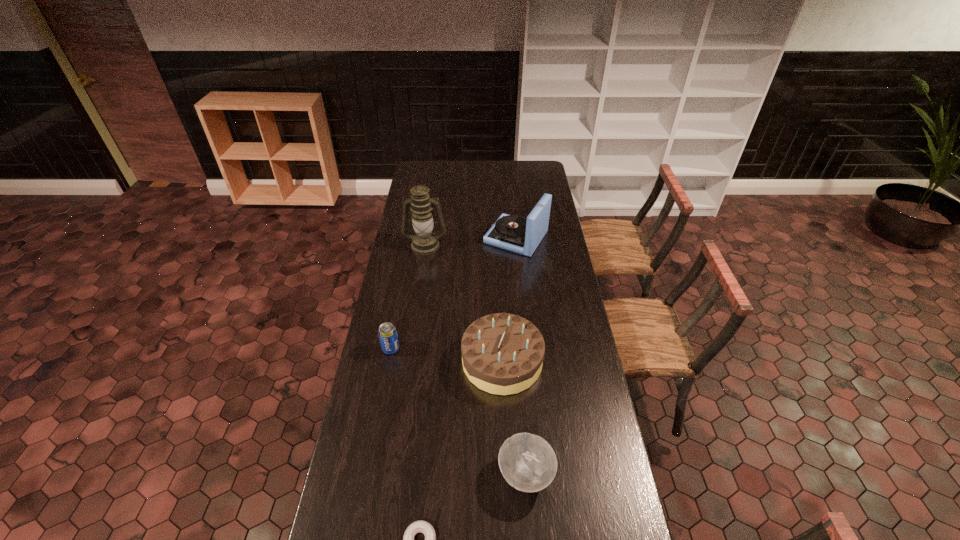
Where is `free space located 0.290m on the front-facing side of the third tallest object`? The image size is (960, 540). free space located 0.290m on the front-facing side of the third tallest object is located at coordinates (385, 361).

The width and height of the screenshot is (960, 540). In order to click on vacant area located on the back of the fourth tallest object in this screenshot , I will do `click(397, 312)`.

Where is `free space located 0.310m on the back of the second shortest object`? This screenshot has height=540, width=960. free space located 0.310m on the back of the second shortest object is located at coordinates (517, 367).

Find the location of a particular element. oil lamp located at the left edge is located at coordinates (424, 242).

Identify the location of soda present at the left edge. (387, 333).

Identify the location of object present at the right edge. Image resolution: width=960 pixels, height=540 pixels. (514, 233).

Find the location of `vacant space at the far edge`. vacant space at the far edge is located at coordinates (505, 165).

Where is `free space at the left edge`? The width and height of the screenshot is (960, 540). free space at the left edge is located at coordinates (401, 305).

Locate an element on the screen. vacant space at the right edge of the desktop is located at coordinates (592, 366).

At what (x,y) coordinates should I click in order to perform the action: click on free point between the birthday cake and the fifth shortest object. Please return your answer as a coordinate pair (x, y). Looking at the image, I should click on (509, 300).